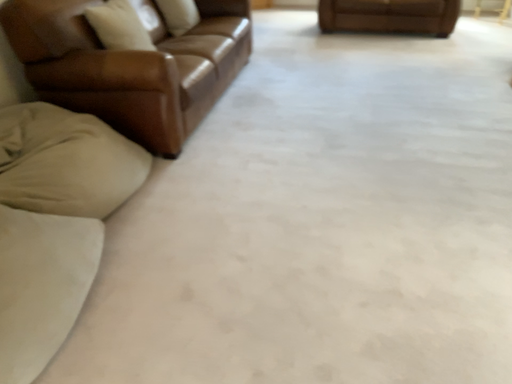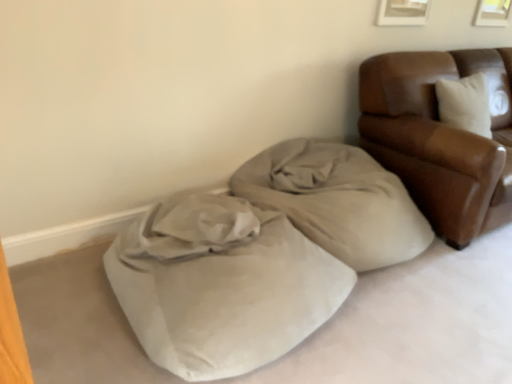
Question: How did the camera likely rotate when shooting the video?

Choices:
 (A) rotated left
 (B) rotated right

Answer: (A)